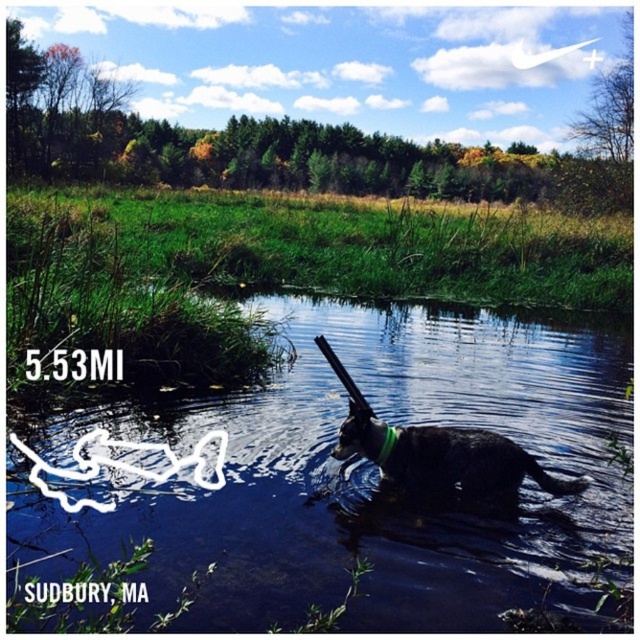
Is black glossy water at lower center bigger than black matte dog at center?

Correct, black glossy water at lower center is larger in size than black matte dog at center.

Who is more distant from viewer, [332,467] or [499,467]?

The point [332,467] is behind.

Which is behind, point (602, 417) or point (458, 465)?

The point (602, 417) is more distant.

The image size is (640, 640). Identify the location of black glossy water at lower center. (364, 476).

Is point (504, 465) closer to viewer compared to point (378, 461)?

Yes, point (504, 465) is in front of point (378, 461).

Is black matte dog at center shorter than green fabric neckband at center?

Incorrect, black matte dog at center's height does not fall short of green fabric neckband at center's.

The height and width of the screenshot is (640, 640). Describe the element at coordinates (465, 465) in the screenshot. I see `black matte dog at center` at that location.

This screenshot has width=640, height=640. Find the location of `black matte dog at center`. black matte dog at center is located at coordinates (465, 465).

How much distance is there between black glossy water at lower center and green fabric neckband at center?

They are 8.48 feet apart.

The image size is (640, 640). What do you see at coordinates (364, 476) in the screenshot? I see `black glossy water at lower center` at bounding box center [364, 476].

Where is `black glossy water at lower center`? This screenshot has height=640, width=640. black glossy water at lower center is located at coordinates (364, 476).

Image resolution: width=640 pixels, height=640 pixels. I want to click on black glossy water at lower center, so click(364, 476).